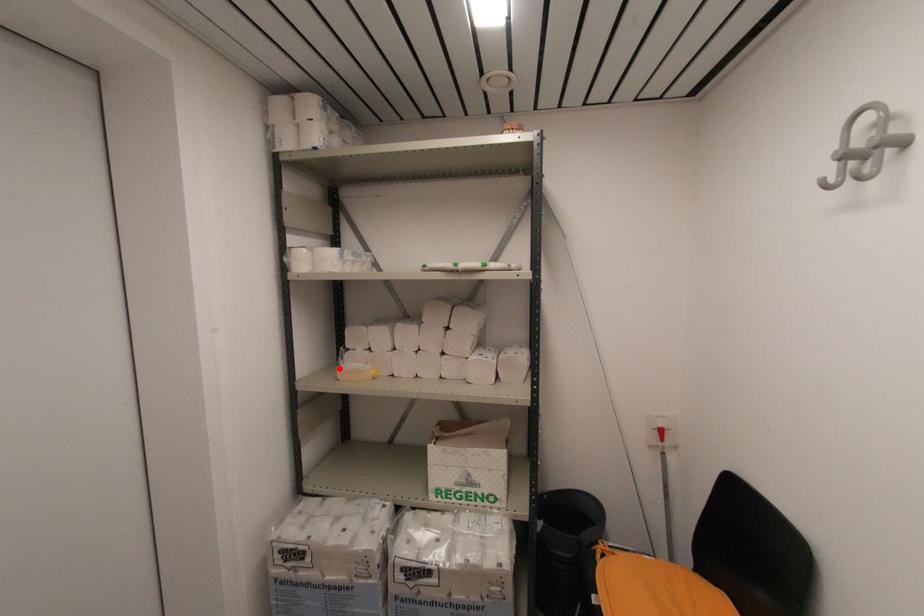
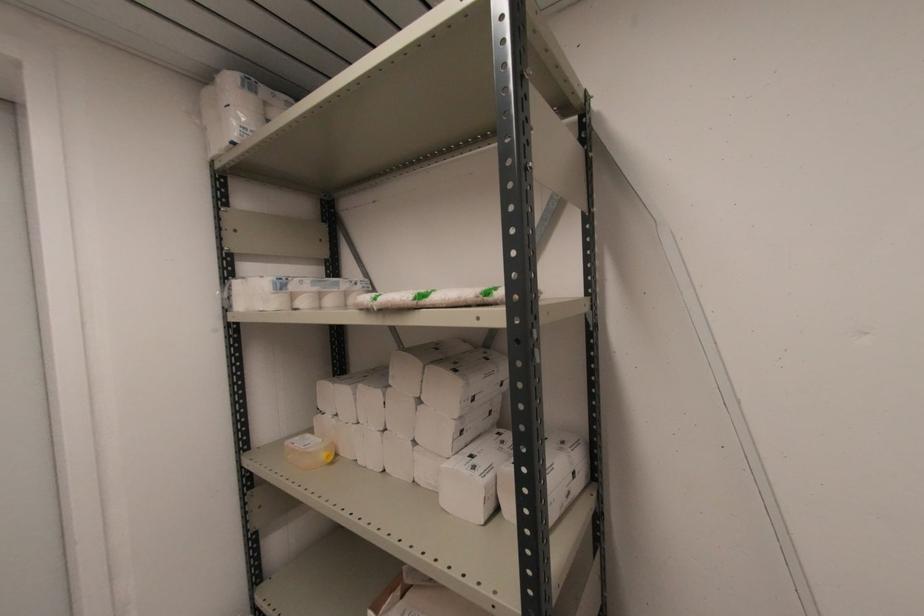
The point at the highlighted location is marked in the first image. Where is the corresponding point in the second image?

(289, 442)